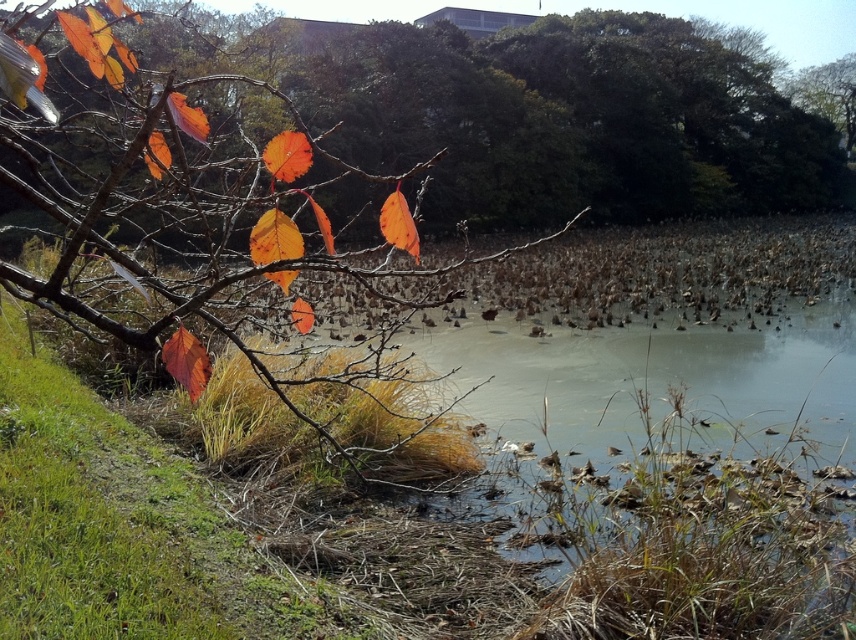
Question: Is matte orange leaves at left to the right of orange matte leaves at upper left from the viewer's perspective?

Choices:
 (A) no
 (B) yes

Answer: (A)

Question: Does matte orange leaves at left appear over orange matte leaves at upper left?

Choices:
 (A) yes
 (B) no

Answer: (B)

Question: Which point is farther from the camera taking this photo?

Choices:
 (A) (589, 195)
 (B) (103, 285)

Answer: (A)

Question: Is matte orange leaves at left thinner than orange matte leaves at upper left?

Choices:
 (A) yes
 (B) no

Answer: (A)